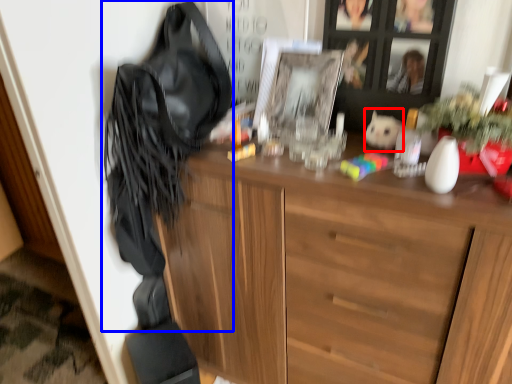
Question: Which object is closer to the camera taking this photo, animal (highlighted by a red box) or shoulder bag (highlighted by a blue box)?

Choices:
 (A) animal
 (B) shoulder bag

Answer: (B)